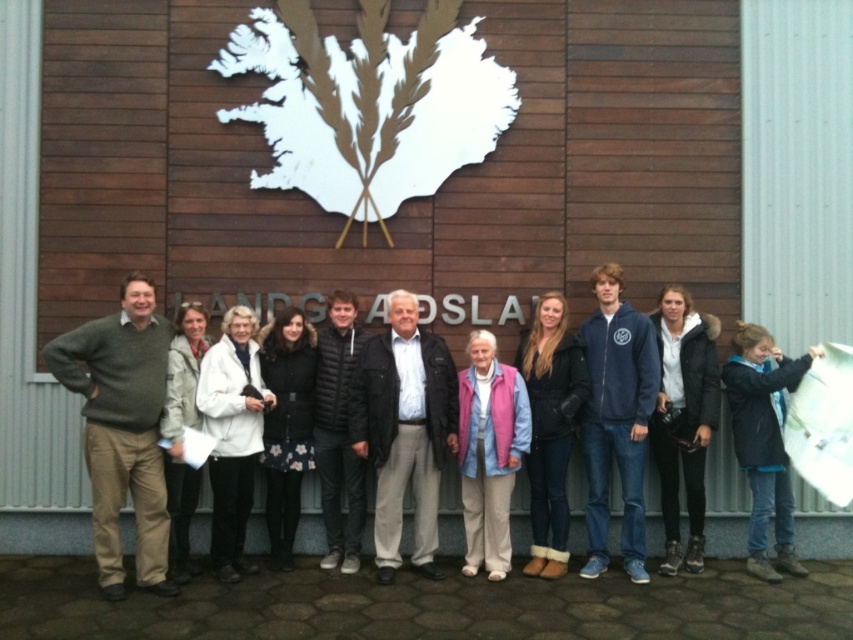
Question: Is green sweater at left further to the viewer compared to navy blue zip-up jacket at center?

Choices:
 (A) no
 (B) yes

Answer: (A)

Question: Which object is the closest to the blue denim jacket at lower right?

Choices:
 (A) black puffer jacket at center
 (B) navy blue zip-up jacket at center
 (C) green sweater at left

Answer: (B)

Question: Among these objects, which one is farthest from the camera?

Choices:
 (A) black puffer jacket at center
 (B) dark gray jacket at center
 (C) green sweater at left

Answer: (A)

Question: Which object is the farthest from the black puffer jacket at center?

Choices:
 (A) blue denim jacket at lower right
 (B) dark gray jacket at center
 (C) navy blue zip-up jacket at center
 (D) green sweater at left

Answer: (A)

Question: From the image, what is the correct spatial relationship of navy blue zip-up jacket at center in relation to blue denim jacket at lower right?

Choices:
 (A) right
 (B) left

Answer: (B)

Question: Is green sweater at left behind dark gray jacket at center?

Choices:
 (A) yes
 (B) no

Answer: (B)